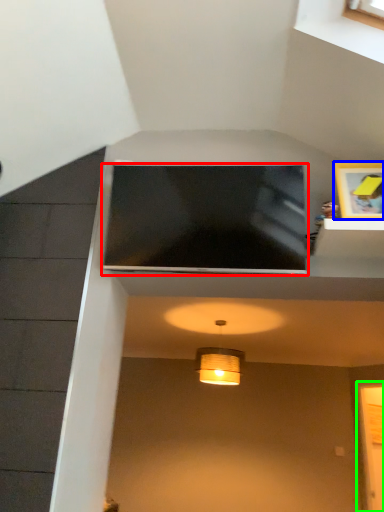
Question: Estimate the real-world distances between objects in this image. Which object is closer to television (highlighted by a red box), picture frame (highlighted by a blue box) or glass door (highlighted by a green box)?

Choices:
 (A) picture frame
 (B) glass door

Answer: (A)